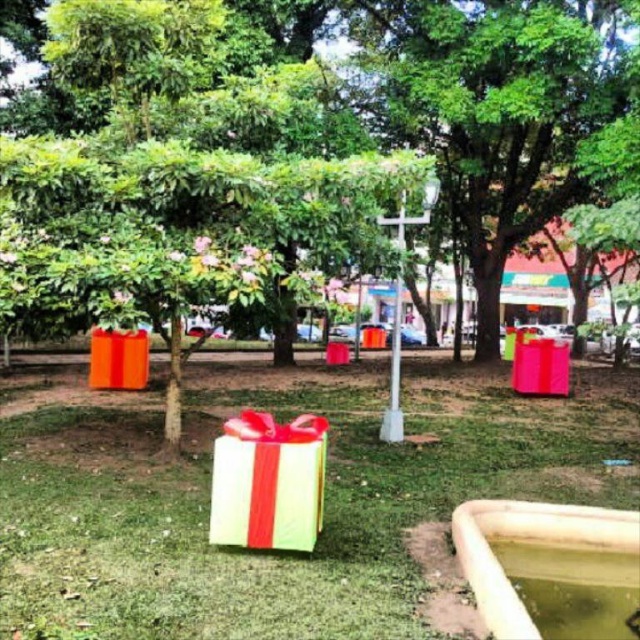
Is green grass at center smaller than matte orange gift at center?

Yes, green grass at center is smaller than matte orange gift at center.

Can you confirm if green grass at center is shorter than matte orange gift at center?

Yes.

Does point (384, 582) come in front of point (61, 80)?

Yes, point (384, 582) is closer to viewer.

Locate an element on the screen. This screenshot has width=640, height=640. green grass at center is located at coordinates (324, 493).

Does matte orange gift at center have a greater width compared to green matte gift box at center?

Indeed, matte orange gift at center has a greater width compared to green matte gift box at center.

Can you confirm if matte orange gift at center is positioned to the left of green matte gift box at center?

No, matte orange gift at center is not to the left of green matte gift box at center.

Locate an element on the screen. The width and height of the screenshot is (640, 640). matte orange gift at center is located at coordinates (365, 93).

Locate an element on the screen. Image resolution: width=640 pixels, height=640 pixels. matte orange gift at center is located at coordinates (365, 93).

Which is more to the right, orange matte gift box at center or pink glossy gift box at center?

Positioned to the right is pink glossy gift box at center.

Can you confirm if orange matte gift box at center is positioned above pink glossy gift box at center?

Yes, orange matte gift box at center is above pink glossy gift box at center.

Measure the distance between point (100, 388) and camera.

Point (100, 388) is 10.52 meters away from camera.

This screenshot has width=640, height=640. What are the coordinates of `orange matte gift box at center` in the screenshot? It's located at (118, 358).